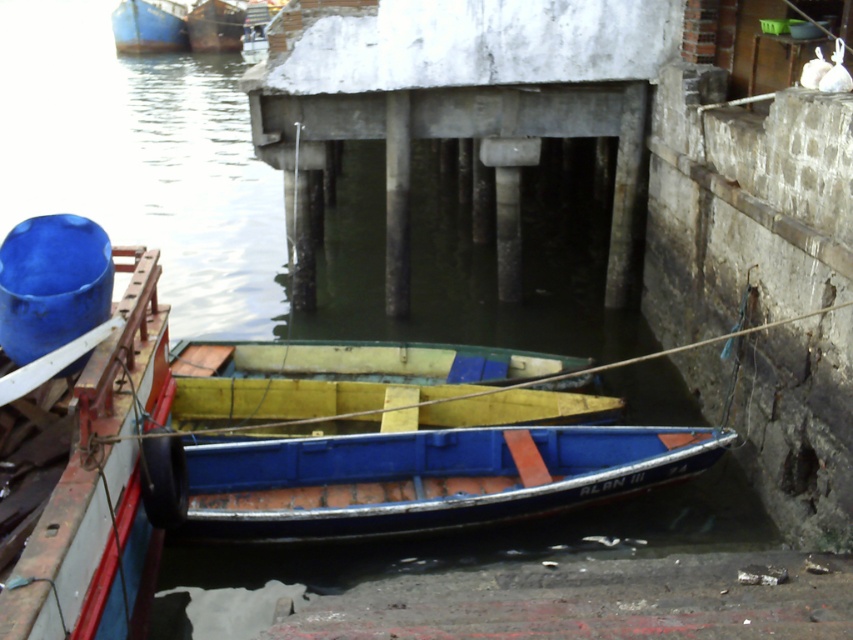
Question: Which point appears closest to the camera in this image?

Choices:
 (A) (126, 490)
 (B) (296, 416)
 (C) (488, 384)
 (D) (462, 464)

Answer: (A)

Question: Considering the real-world distances, which object is closest to the yellow matte canoe at center?

Choices:
 (A) smooth blue boat at left
 (B) yellow matte wood canoe at center

Answer: (B)

Question: Which object is farther from the camera taking this photo?

Choices:
 (A) smooth blue boat at left
 (B) yellow matte canoe at center

Answer: (B)

Question: Can you confirm if smooth blue boat at left is positioned to the right of blue painted wood canoe at center?

Choices:
 (A) no
 (B) yes

Answer: (A)

Question: Considering the relative positions of smooth blue boat at left and yellow matte wood canoe at center in the image provided, where is smooth blue boat at left located with respect to yellow matte wood canoe at center?

Choices:
 (A) below
 (B) above

Answer: (B)

Question: Does blue painted wood canoe at center have a smaller size compared to yellow matte wood canoe at center?

Choices:
 (A) no
 (B) yes

Answer: (A)